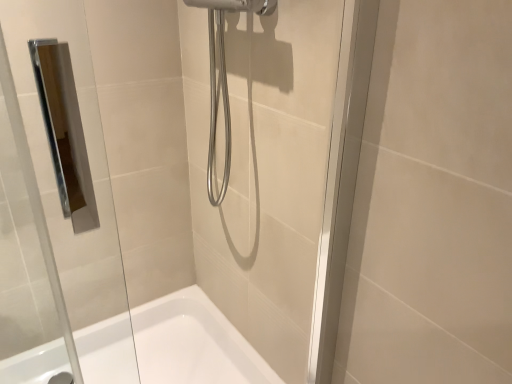
What do you see at coordinates (162, 176) in the screenshot? I see `transparent glass door at center` at bounding box center [162, 176].

Image resolution: width=512 pixels, height=384 pixels. Find the location of `transparent glass door at center`. transparent glass door at center is located at coordinates (162, 176).

What is the approximate width of transparent glass door at center?

2.61 inches.

Describe the element at coordinates (193, 343) in the screenshot. I see `white glossy bathtub at lower center` at that location.

Locate an element on the screen. The width and height of the screenshot is (512, 384). white glossy bathtub at lower center is located at coordinates (193, 343).

The width and height of the screenshot is (512, 384). I want to click on transparent glass door at center, so click(x=162, y=176).

Considering the positions of objects transparent glass door at center and white glossy bathtub at lower center in the image provided, who is more to the right, transparent glass door at center or white glossy bathtub at lower center?

From the viewer's perspective, transparent glass door at center appears more on the right side.

Consider the image. Which object is further away from the camera taking this photo, transparent glass door at center or white glossy bathtub at lower center?

white glossy bathtub at lower center is behind.

Considering the positions of point (77, 299) and point (142, 367), is point (77, 299) closer or farther from the camera than point (142, 367)?

Point (77, 299) is positioned farther from the camera compared to point (142, 367).

From the picture: From the image's perspective, is transparent glass door at center below white glossy bathtub at lower center?

Incorrect, from the image's perspective, transparent glass door at center is higher than white glossy bathtub at lower center.

From a real-world perspective, between transparent glass door at center and white glossy bathtub at lower center, who is vertically lower?

In real-world perspective, white glossy bathtub at lower center is lower.

Does transparent glass door at center have a greater width compared to white glossy bathtub at lower center?

No.

Can you confirm if transparent glass door at center is taller than white glossy bathtub at lower center?

Correct, transparent glass door at center is much taller as white glossy bathtub at lower center.

Between transparent glass door at center and white glossy bathtub at lower center, which one has larger size?

With larger size is white glossy bathtub at lower center.

Is white glossy bathtub at lower center inside transparent glass door at center?

No, white glossy bathtub at lower center is not inside transparent glass door at center.

Is transparent glass door at center not close to white glossy bathtub at lower center?

They are positioned close to each other.

Is transparent glass door at center facing towards white glossy bathtub at lower center?

No, transparent glass door at center is not oriented towards white glossy bathtub at lower center.

Where is `bathtub lying behind the transparent glass door at center`? The height and width of the screenshot is (384, 512). bathtub lying behind the transparent glass door at center is located at coordinates (193, 343).

Based on the photo, considering the relative positions of white glossy bathtub at lower center and transparent glass door at center in the image provided, is white glossy bathtub at lower center to the right of transparent glass door at center from the viewer's perspective?

No.

Does white glossy bathtub at lower center come in front of transparent glass door at center?

No, it is behind transparent glass door at center.

Considering the points (142, 346) and (31, 286), which point is behind, point (142, 346) or point (31, 286)?

The point (142, 346) is behind.

From the image's perspective, is white glossy bathtub at lower center on transparent glass door at center?

Actually, white glossy bathtub at lower center appears below transparent glass door at center in the image.

From a real-world perspective, is white glossy bathtub at lower center beneath transparent glass door at center?

Correct, in the physical world, white glossy bathtub at lower center is lower than transparent glass door at center.

Between white glossy bathtub at lower center and transparent glass door at center, which one has smaller width?

With smaller width is transparent glass door at center.

Considering the sizes of objects white glossy bathtub at lower center and transparent glass door at center in the image provided, who is taller, white glossy bathtub at lower center or transparent glass door at center?

transparent glass door at center is taller.

Who is smaller, white glossy bathtub at lower center or transparent glass door at center?

With smaller size is transparent glass door at center.

Is white glossy bathtub at lower center located outside transparent glass door at center?

Indeed, white glossy bathtub at lower center is completely outside transparent glass door at center.

Based on the photo, is white glossy bathtub at lower center beside transparent glass door at center?

white glossy bathtub at lower center and transparent glass door at center are clearly separated.

Could you tell me if white glossy bathtub at lower center is turned towards transparent glass door at center?

No, white glossy bathtub at lower center is not aimed at transparent glass door at center.

This screenshot has width=512, height=384. In order to click on glass door above the white glossy bathtub at lower center (from a real-world perspective) in this screenshot , I will do `click(162, 176)`.

Find the location of a particular element. This screenshot has height=384, width=512. bathtub on the left of transparent glass door at center is located at coordinates [x=193, y=343].

In order to click on bathtub below the transparent glass door at center (from the image's perspective) in this screenshot , I will do `click(193, 343)`.